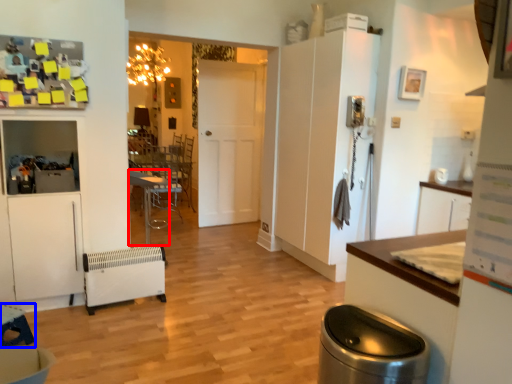
Question: Among these objects, which one is farthest to the camera, table (highlighted by a red box) or table (highlighted by a blue box)?

Choices:
 (A) table
 (B) table

Answer: (A)